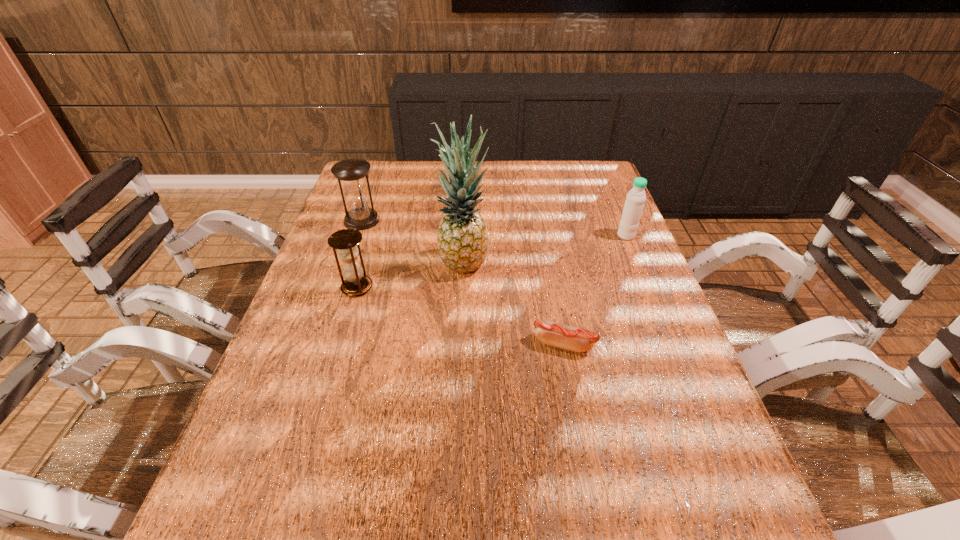
You are a GUI agent. You are given a task and a screenshot of the screen. Output one action in this format:
    pyautogui.click(x=<x>, y=<y>)
    Task: Click on the vacant space in between the pineapple and the shortest object
    
    Given the screenshot: What is the action you would take?
    pyautogui.click(x=514, y=303)

At what (x,y) coordinates should I click in order to perform the action: click on free space between the shortest object and the nearer hourglass. Please return your answer as a coordinate pair (x, y). This screenshot has width=960, height=540. Looking at the image, I should click on (461, 316).

You are a GUI agent. You are given a task and a screenshot of the screen. Output one action in this format:
    pyautogui.click(x=<x>, y=<y>)
    Task: Click on the free space between the nearest object and the nearer hourglass
    The image size is (960, 540).
    Given the screenshot: What is the action you would take?
    click(461, 316)

Identify the location of free space between the rightmost object and the nearer hourglass. The width and height of the screenshot is (960, 540). (492, 261).

Where is `vacant region between the shortest object and the rightmost object`? The width and height of the screenshot is (960, 540). vacant region between the shortest object and the rightmost object is located at coordinates (595, 290).

Locate an element on the screen. The image size is (960, 540). empty space between the water bottle and the nearer hourglass is located at coordinates click(x=492, y=261).

Locate an element on the screen. object that ranks as the second closest to the nearer hourglass is located at coordinates (352, 172).

What are the coordinates of `object that can be found as the closest to the farther hourglass` in the screenshot? It's located at (355, 284).

In order to click on free point that satisfies the following two spatial constraints: 1. on the back side of the nearer hourglass; 2. on the left side of the tallest object in this screenshot , I will do `click(365, 262)`.

Find the location of a particular element. This screenshot has width=960, height=540. vacant space that satisfies the following two spatial constraints: 1. on the front side of the fourth object from left to right; 2. on the left side of the nearer hourglass is located at coordinates (340, 344).